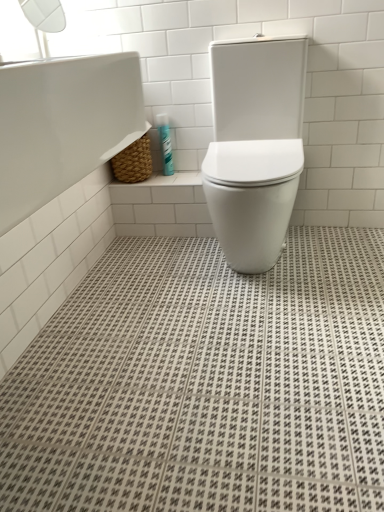
Question: Could white glossy toilet at center be considered to be inside teal plastic toothpaste tube at upper center?

Choices:
 (A) yes
 (B) no

Answer: (B)

Question: Are teal plastic toothpaste tube at upper center and white glossy toilet at center located far from each other?

Choices:
 (A) no
 (B) yes

Answer: (A)

Question: Can you confirm if teal plastic toothpaste tube at upper center is positioned to the right of white glossy toilet at center?

Choices:
 (A) no
 (B) yes

Answer: (A)

Question: Can you confirm if teal plastic toothpaste tube at upper center is thinner than white glossy toilet at center?

Choices:
 (A) no
 (B) yes

Answer: (B)

Question: From a real-world perspective, is teal plastic toothpaste tube at upper center on white glossy toilet at center?

Choices:
 (A) no
 (B) yes

Answer: (A)

Question: Is teal plastic toothpaste tube at upper center oriented away from white glossy toilet at center?

Choices:
 (A) no
 (B) yes

Answer: (A)

Question: Is white glossy toilet at center to the right of transparent plastic window screen at upper left from the viewer's perspective?

Choices:
 (A) yes
 (B) no

Answer: (A)

Question: Considering the relative positions of white glossy toilet at center and transparent plastic window screen at upper left in the image provided, is white glossy toilet at center behind transparent plastic window screen at upper left?

Choices:
 (A) yes
 (B) no

Answer: (B)

Question: Is white glossy toilet at center oriented towards transparent plastic window screen at upper left?

Choices:
 (A) yes
 (B) no

Answer: (B)

Question: Is white glossy toilet at center oriented away from transparent plastic window screen at upper left?

Choices:
 (A) no
 (B) yes

Answer: (A)

Question: Is white glossy toilet at center to the left of transparent plastic window screen at upper left from the viewer's perspective?

Choices:
 (A) no
 (B) yes

Answer: (A)

Question: Are white glossy toilet at center and transparent plastic window screen at upper left making contact?

Choices:
 (A) no
 (B) yes

Answer: (A)

Question: Can you confirm if white glossy toilet at center is thinner than white glossy bathtub at upper left?

Choices:
 (A) no
 (B) yes

Answer: (A)